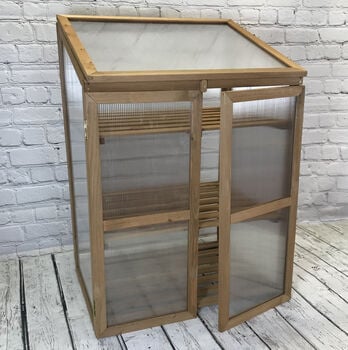
Where is `white brick wall`? The image size is (348, 350). white brick wall is located at coordinates (325, 89).